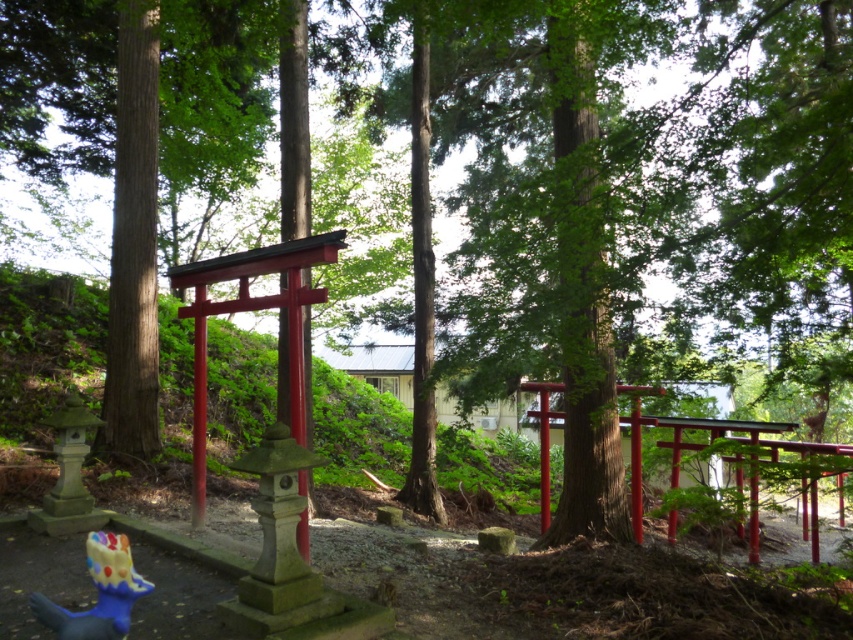
Question: From the image, what is the correct spatial relationship of metallic red torii gate at center in relation to blue rubber toy at lower left?

Choices:
 (A) left
 (B) right

Answer: (B)

Question: Where is metallic red torii gate at center located in relation to blue rubber toy at lower left in the image?

Choices:
 (A) above
 (B) below

Answer: (B)

Question: Which object appears closest to the camera in this image?

Choices:
 (A) blue rubber toy at lower left
 (B) metallic red torii gate at center

Answer: (A)

Question: Which point appears closest to the camera in this image?

Choices:
 (A) [111, 538]
 (B) [811, 554]

Answer: (A)

Question: Which of the following is the closest to the observer?

Choices:
 (A) metallic red torii gate at center
 (B) blue rubber toy at lower left

Answer: (B)

Question: Is metallic red torii gate at center above blue rubber toy at lower left?

Choices:
 (A) yes
 (B) no

Answer: (B)